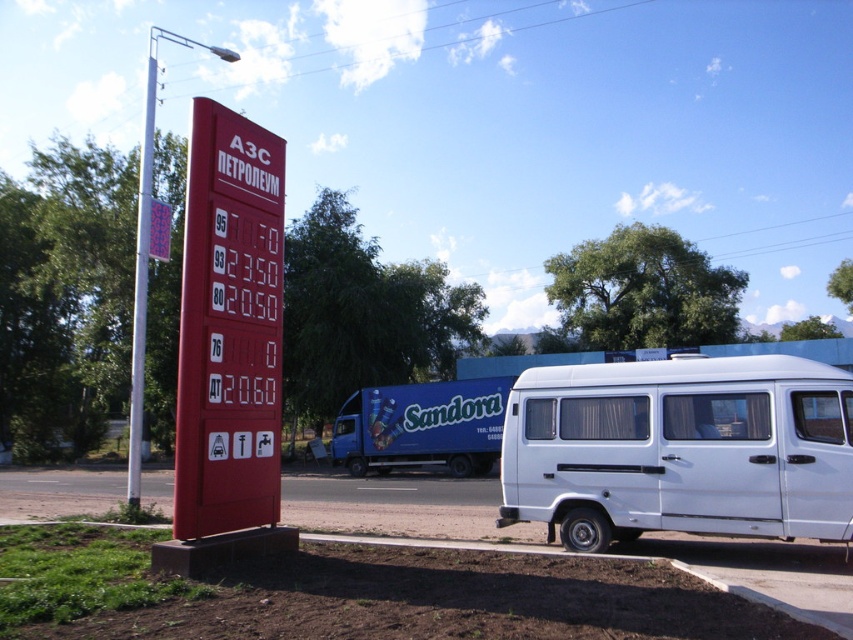
Does matte red gas price board at center have a lesser height compared to white plastic pole at upper left?

Correct, matte red gas price board at center is not as tall as white plastic pole at upper left.

Is matte red gas price board at center in front of white plastic pole at upper left?

Yes.

Where is `matte red gas price board at center`? matte red gas price board at center is located at coordinates (229, 326).

Locate an element on the screen. The width and height of the screenshot is (853, 640). smooth red sign at left is located at coordinates (148, 248).

Does smooth red sign at left have a lesser height compared to white plastic pole at upper left?

Yes.

Who is more distant from viewer, (151,54) or (134,401)?

The point (151,54) is more distant.

Locate an element on the screen. This screenshot has height=640, width=853. smooth red sign at left is located at coordinates (148, 248).

Between white matte van at right and smooth red sign at left, which one appears on the right side from the viewer's perspective?

white matte van at right

Is point (543, 397) positioned in front of point (142, 352)?

Yes, it is.

Is point (637, 464) positioned behind point (144, 134)?

No, (637, 464) is in front of (144, 134).

This screenshot has height=640, width=853. I want to click on white matte van at right, so click(x=680, y=449).